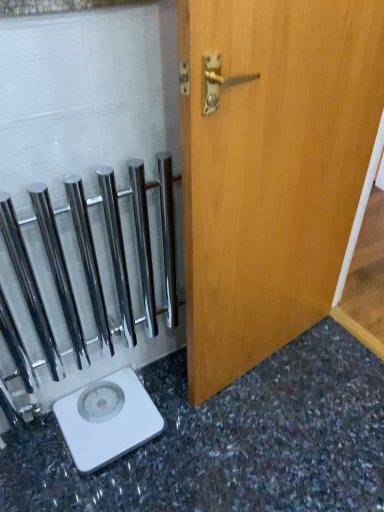
Where is `empty space that is ontop of white plastic scale at lower left (from a real-world perspective)`? The image size is (384, 512). empty space that is ontop of white plastic scale at lower left (from a real-world perspective) is located at coordinates (104, 406).